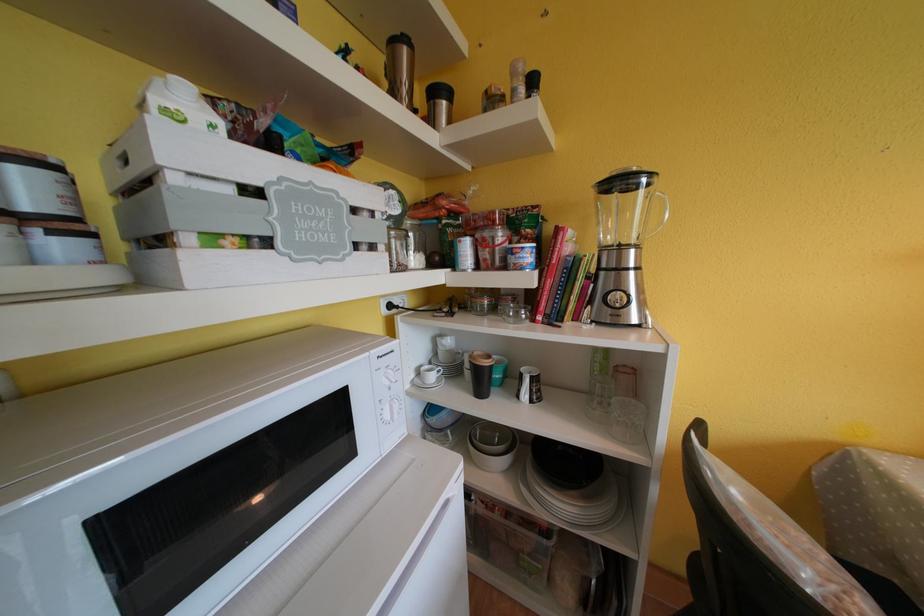
At what (x,y) coordinates should I click in order to perform the action: click on white power plug. Please return your answer as a coordinate pair (x, y). The width and height of the screenshot is (924, 616). Looking at the image, I should click on (392, 302).